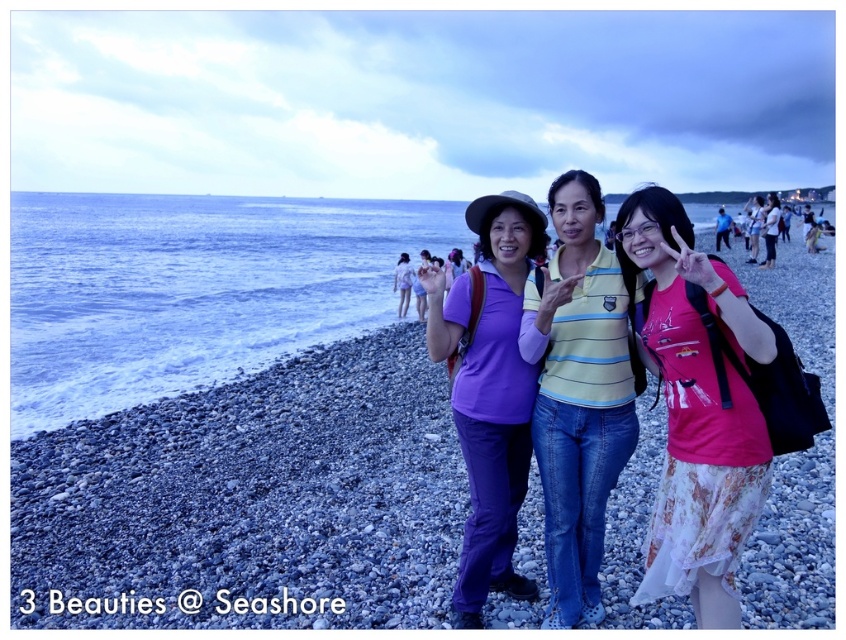
Question: Which object is closer to the camera taking this photo?

Choices:
 (A) matte purple pants at center
 (B) pink lace skirt at center

Answer: (B)

Question: Can you confirm if pebble beach at center is wider than matte purple pants at center?

Choices:
 (A) no
 (B) yes

Answer: (B)

Question: Is pebble beach at center positioned in front of pink lace skirt at center?

Choices:
 (A) yes
 (B) no

Answer: (B)

Question: Which object appears closest to the camera in this image?

Choices:
 (A) pink lace skirt at center
 (B) matte purple pants at center

Answer: (A)

Question: Observing the image, what is the correct spatial positioning of pebble beach at center in reference to pink lace skirt at center?

Choices:
 (A) below
 (B) above

Answer: (B)

Question: Which of the following is the farthest from the observer?

Choices:
 (A) (463, 342)
 (B) (828, 564)

Answer: (A)